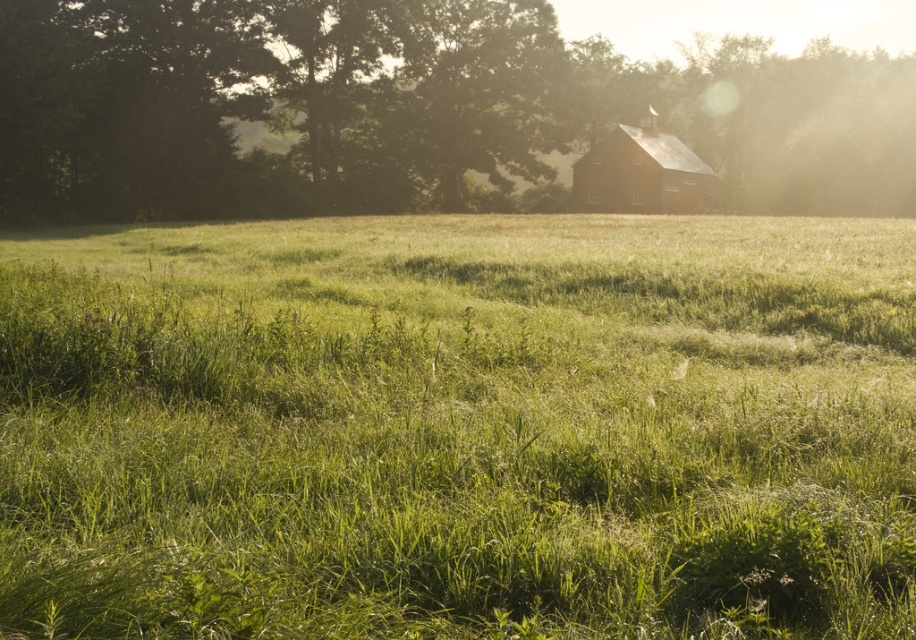
Question: Can you confirm if green grassy pasture at center is positioned below green leafy tree at upper center?

Choices:
 (A) yes
 (B) no

Answer: (A)

Question: Which of the following is the closest to the observer?

Choices:
 (A) (515, 72)
 (B) (406, 512)

Answer: (B)

Question: Which object is positioned farthest from the green grassy pasture at center?

Choices:
 (A) green leafy tree at upper center
 (B) matte red barn at center

Answer: (B)

Question: Among these points, which one is nearest to the camera?

Choices:
 (A) (566, 419)
 (B) (880, 60)

Answer: (A)

Question: Can you confirm if green grassy pasture at center is positioned below green leafy tree at upper center?

Choices:
 (A) no
 (B) yes

Answer: (B)

Question: Can you confirm if green leafy tree at upper center is positioned above matte red barn at center?

Choices:
 (A) yes
 (B) no

Answer: (A)